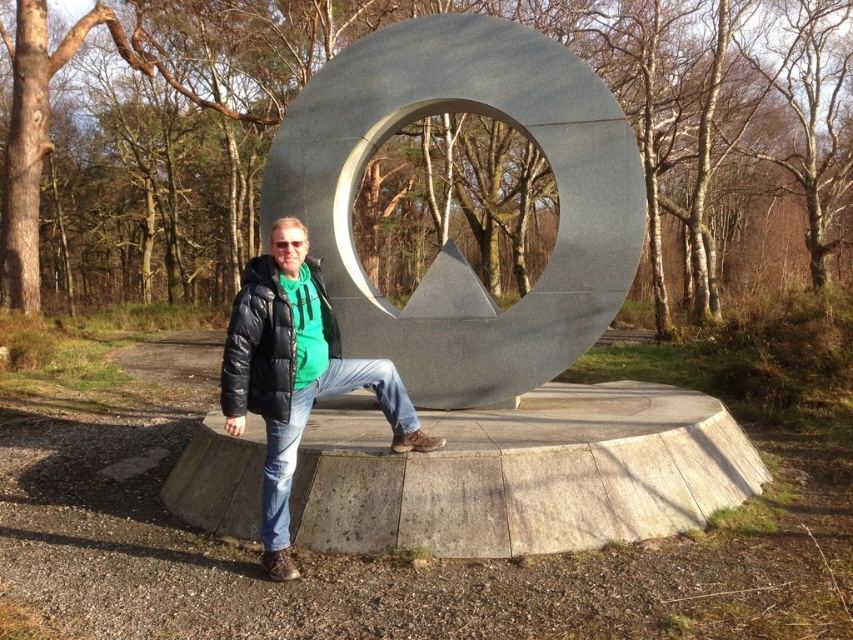
Does black matte jacket at center have a lesser width compared to black puffer jacket at center?

In fact, black matte jacket at center might be wider than black puffer jacket at center.

Does black matte jacket at center have a lesser height compared to black puffer jacket at center?

In fact, black matte jacket at center may be taller than black puffer jacket at center.

Where is `black matte jacket at center`? black matte jacket at center is located at coordinates (294, 372).

You are a GUI agent. You are given a task and a screenshot of the screen. Output one action in this format:
    pyautogui.click(x=<x>, y=<y>)
    Task: Click on the black matte jacket at center
    
    Given the screenshot: What is the action you would take?
    pyautogui.click(x=294, y=372)

Is polished metal circle at center bigger than black puffer jacket at center?

Yes, polished metal circle at center is bigger than black puffer jacket at center.

Which is below, polished metal circle at center or black puffer jacket at center?

Positioned lower is black puffer jacket at center.

What do you see at coordinates (453, 243) in the screenshot?
I see `polished metal circle at center` at bounding box center [453, 243].

Locate an element on the screen. Image resolution: width=853 pixels, height=640 pixels. polished metal circle at center is located at coordinates (453, 243).

Is polished metal circle at center smaller than black matte jacket at center?

No.

Can you confirm if polished metal circle at center is positioned to the right of black matte jacket at center?

Correct, you'll find polished metal circle at center to the right of black matte jacket at center.

Does point (341, 141) come in front of point (267, 282)?

No, (341, 141) is further to viewer.

Find the location of a particular element. Image resolution: width=853 pixels, height=640 pixels. polished metal circle at center is located at coordinates (453, 243).